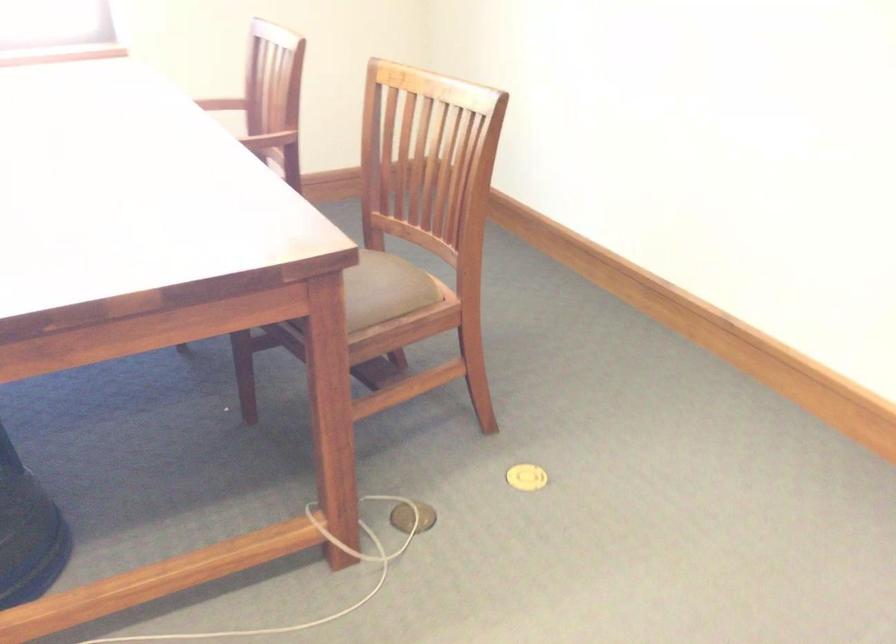
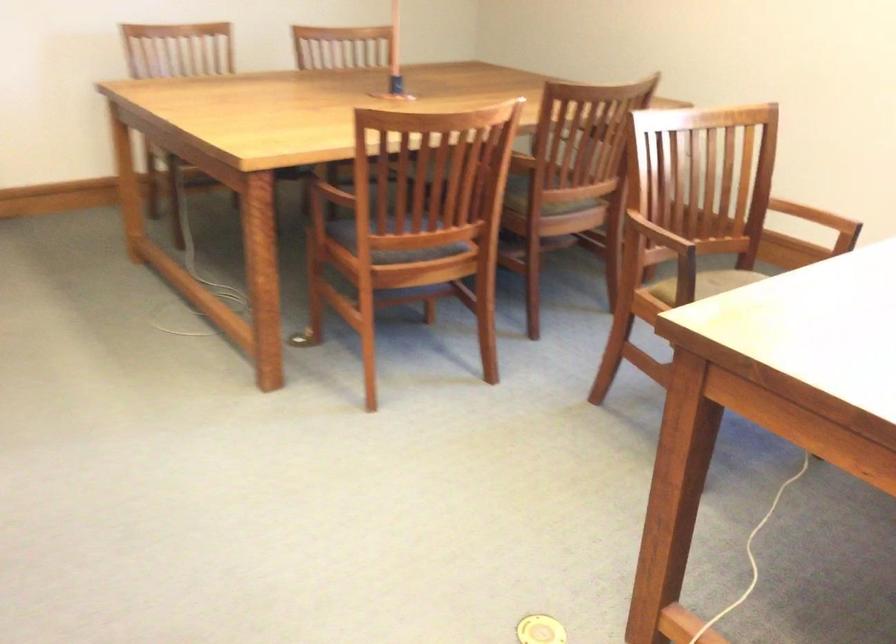
Based on the continuous images, in which direction is the camera rotating?

The camera's rotation is toward left-down.